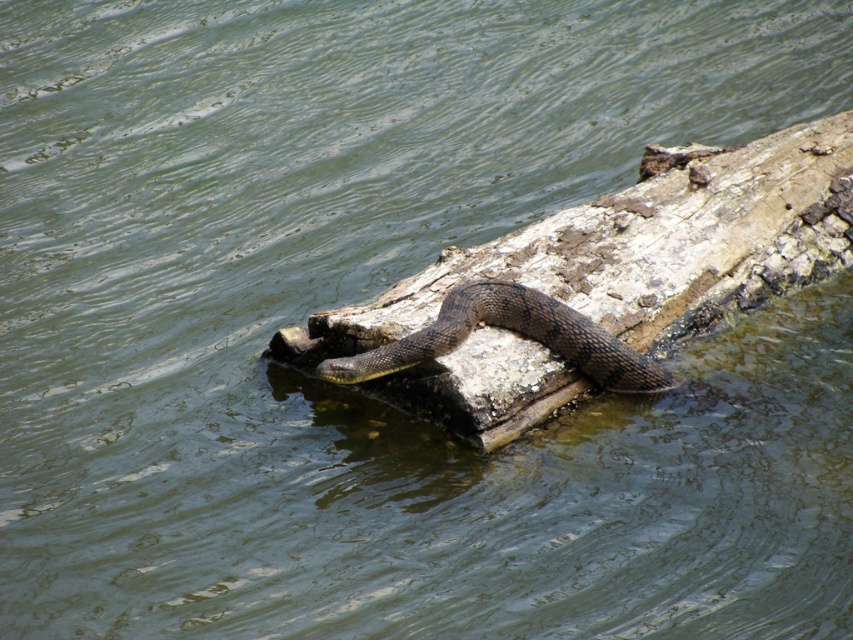
You are a wildlife photographer trying to capture a clear image of the brown scaly snake at center and the brown rough wood log at center. Since the water is murky, you need to focus on the visible parts above the water. Which object is positioned to the right of the other?

The brown rough wood log at center is positioned on the right side of brown scaly snake at center, so the log is to the right of the snake.

You are a photographer trying to capture the snake on the log. You notice two points of interest in your camera viewfinder at coordinates point (656, 349) and point (578, 337). Which point is closer to the camera lens?

Point (656, 349) is further to the viewer than point (578, 337), so the point closer to the camera lens is point (578, 337).